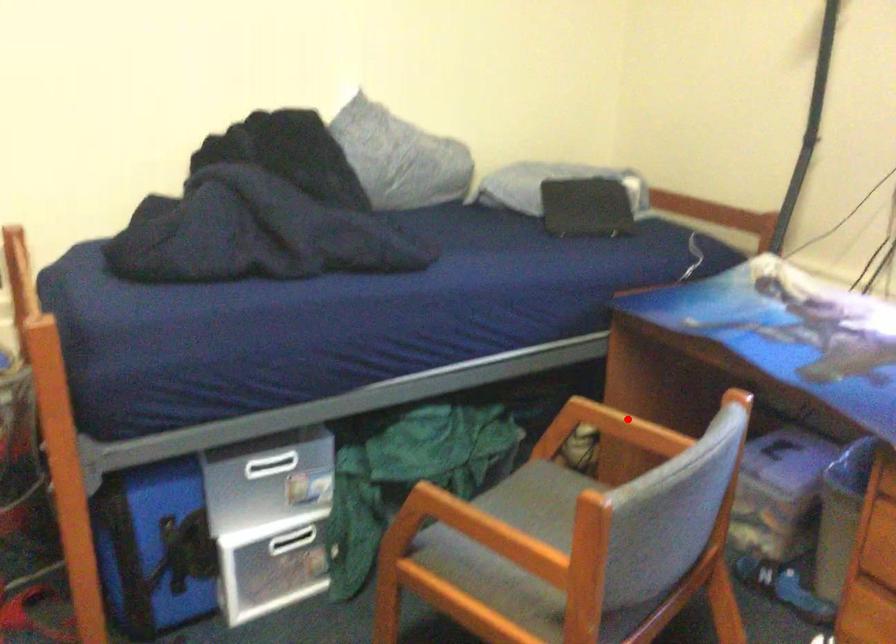
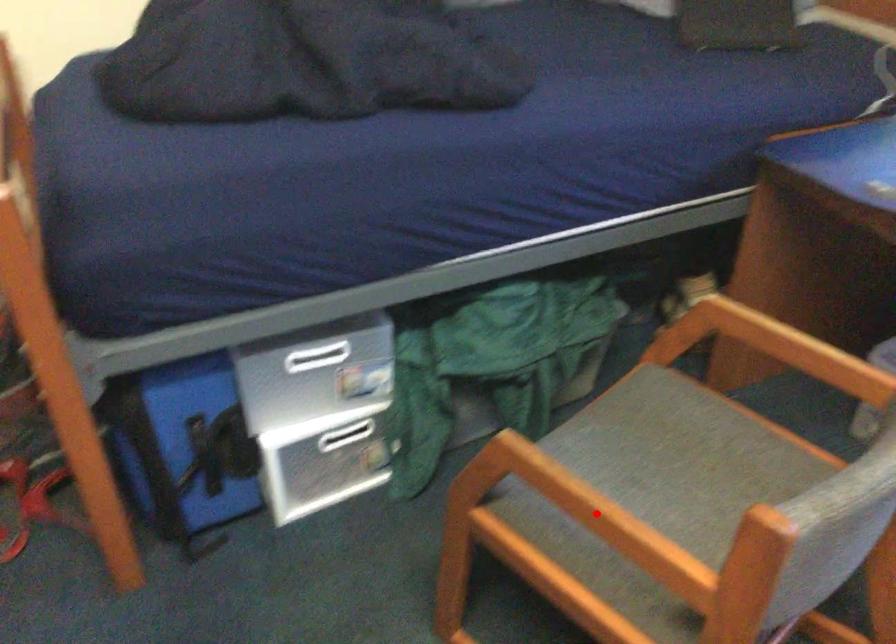
I am providing you with two images of the same scene from different viewpoints. A red point is marked on the first image and another point is marked on the second image. Does the point marked in image1 correspond to the same location as the one in image2?

No